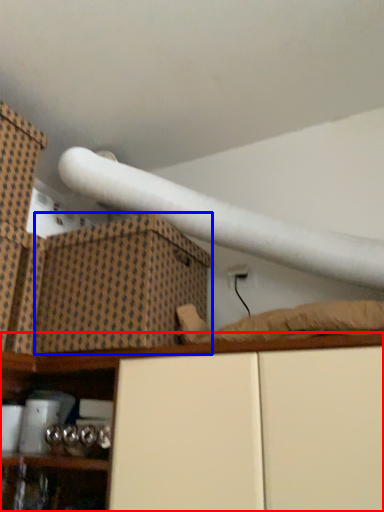
Question: Which object is closer to the camera taking this photo, shelf (highlighted by a red box) or cardboard box (highlighted by a blue box)?

Choices:
 (A) shelf
 (B) cardboard box

Answer: (A)